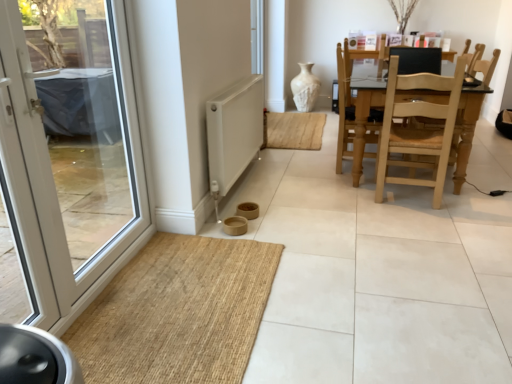
Question: Is white glass door at left taller or shorter than light brown wooden swivel chair at center?

Choices:
 (A) short
 (B) tall

Answer: (B)

Question: Which is correct: white glass door at left is inside light brown wooden swivel chair at center, or outside of it?

Choices:
 (A) inside
 (B) outside

Answer: (B)

Question: Which of these objects is positioned farthest from the white glass door at left?

Choices:
 (A) light brown wooden swivel chair at center
 (B) white textured vase at center
 (C) white matte radiator at lower center
 (D) light wood/wooden chair at right
 (E) black matte chair back at upper right

Answer: (B)

Question: Which is nearer to the light brown wooden swivel chair at center?

Choices:
 (A) white glass door at left
 (B) black matte chair back at upper right
 (C) brown woven mat at lower left
 (D) light wood/wooden chair at right
 (E) white textured vase at center

Answer: (D)